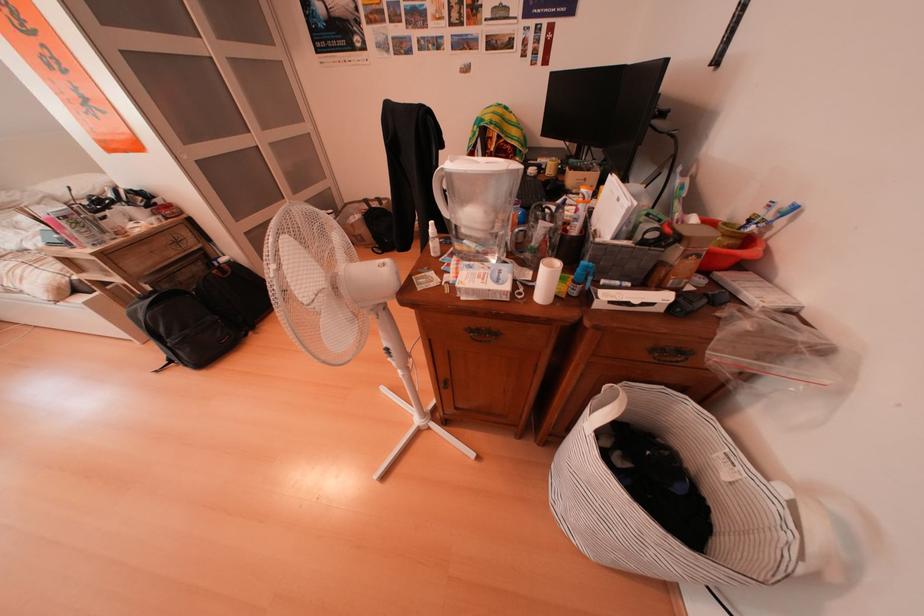
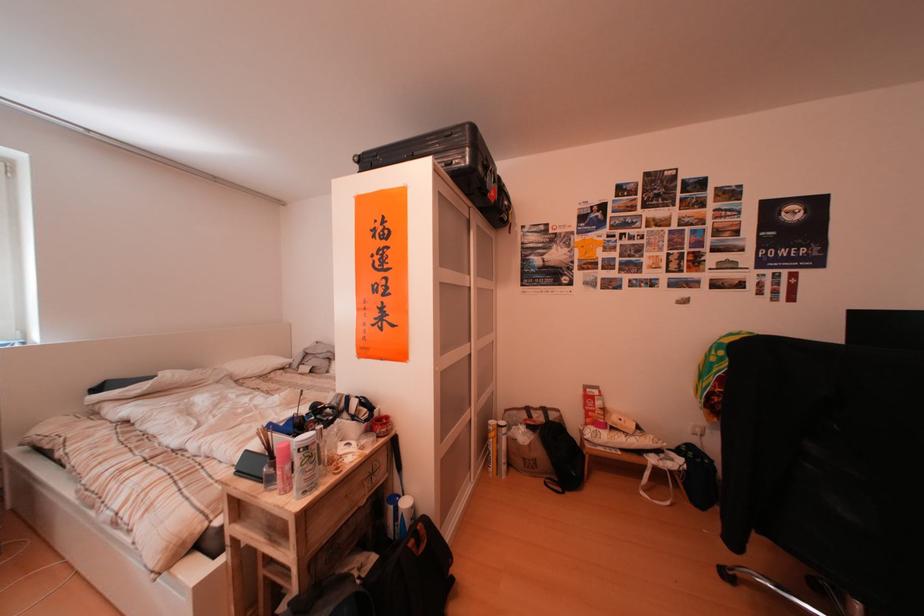
Locate, in the second image, the point that corresponds to the point at 166,219 in the first image.

(381, 436)